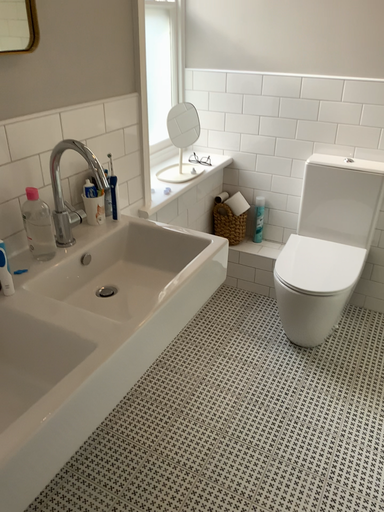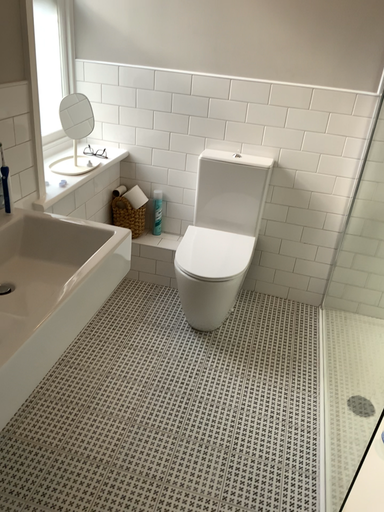
Question: How did the camera likely rotate when shooting the video?

Choices:
 (A) rotated left
 (B) rotated right

Answer: (B)